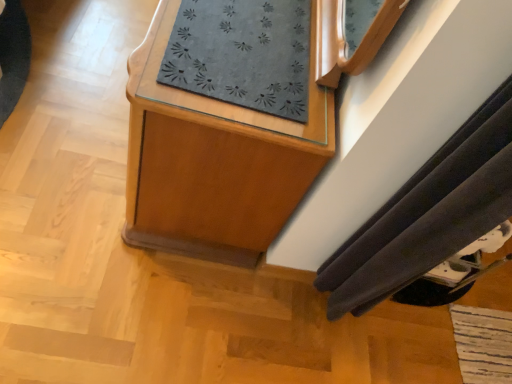
The width and height of the screenshot is (512, 384). Find the location of `vacant space in front of wooden cabinet at center`. vacant space in front of wooden cabinet at center is located at coordinates (126, 273).